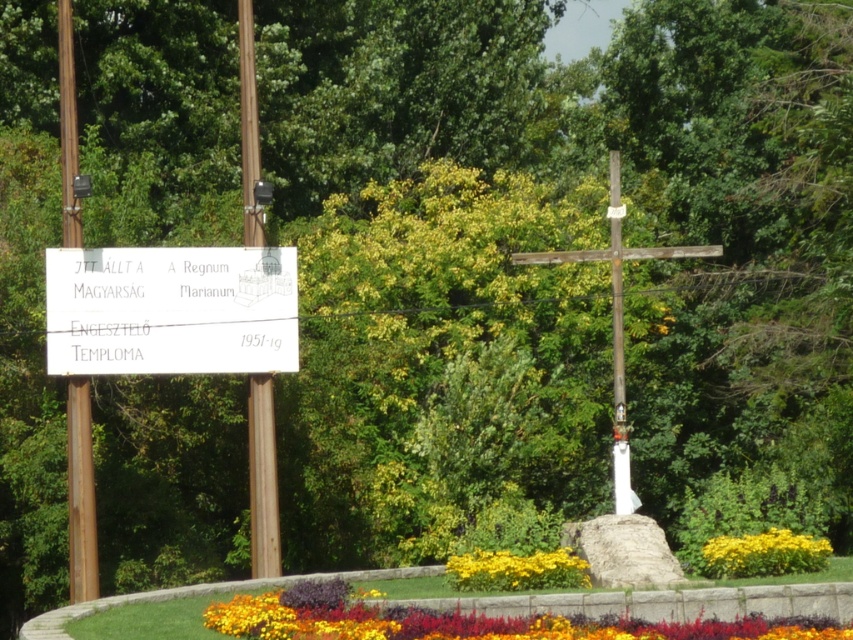
You are planning to place a new decorative item in the garden. You have a small statue that needs to be placed between the multicolored fabric flowers at lower center and the yellow matte flower at lower right. Considering their sizes, which flower should the statue be placed closer to for balance?

The multicolored fabric flowers at lower center is smaller than the yellow matte flower at lower right. To achieve balance, the statue should be placed closer to the multicolored fabric flowers at lower center to compensate for its smaller size.

Based on the photo, you are a gardener who needs to place a new decorative item that is 1.2 meters wide. You see the smooth wooden post at center and the yellow matte flower at lower center. Which object can accommodate the item if placed next to it without overlapping?

The yellow matte flower at lower center can accommodate the item since it has a greater width than the smooth wooden post at center, making it more suitable for placing the 1.2 meter wide decorative item next to it.

You are standing in the park and want to pick up the multicolored fabric flowers at lower center and the yellow matte flower at lower right. Which one do you need to bend down more to reach?

You need to bend down more to reach the multicolored fabric flowers at lower center because it is closer to the viewer than the yellow matte flower at lower right.